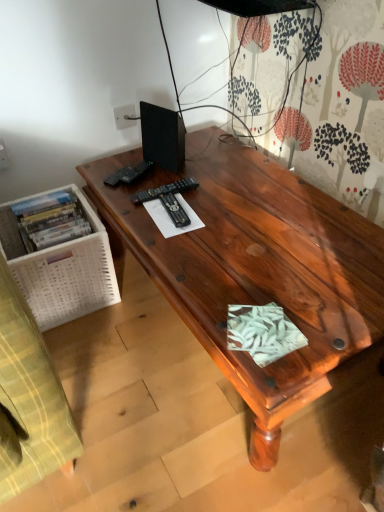
Question: Is black plastic remote control at center, which appears as the 1th remote control when viewed from the front, at the left side of black plastic remote control at center, acting as the second remote control starting from the front?

Choices:
 (A) yes
 (B) no

Answer: (B)

Question: Is black plastic remote control at center, the 3th remote control positioned from the back, aimed at black plastic remote control at center, acting as the second remote control starting from the front?

Choices:
 (A) yes
 (B) no

Answer: (B)

Question: Does black plastic remote control at center, the 3th remote control positioned from the back, have a larger size compared to black plastic remote control at center, acting as the second remote control starting from the front?

Choices:
 (A) no
 (B) yes

Answer: (A)

Question: Considering the relative sizes of black plastic remote control at center, the 3th remote control positioned from the back, and black plastic remote control at center, acting as the second remote control starting from the front, in the image provided, is black plastic remote control at center, the 3th remote control positioned from the back, wider than black plastic remote control at center, acting as the second remote control starting from the front,?

Choices:
 (A) yes
 (B) no

Answer: (B)

Question: Are black plastic remote control at center, the 3th remote control positioned from the back, and black plastic remote control at center, the 2th remote control viewed from the back, located far from each other?

Choices:
 (A) yes
 (B) no

Answer: (B)

Question: From a real-world perspective, is black plastic remote control at center, the 2th remote control viewed from the back, above or below black matte speaker at upper left?

Choices:
 (A) above
 (B) below

Answer: (B)

Question: Visually, is black plastic remote control at center, the 2th remote control viewed from the back, positioned to the left or to the right of black matte speaker at upper left?

Choices:
 (A) left
 (B) right

Answer: (B)

Question: Looking at the image, does black plastic remote control at center, acting as the second remote control starting from the front, seem bigger or smaller compared to black matte speaker at upper left?

Choices:
 (A) small
 (B) big

Answer: (A)

Question: From their relative heights in the image, would you say black plastic remote control at center, acting as the second remote control starting from the front, is taller or shorter than black matte speaker at upper left?

Choices:
 (A) tall
 (B) short

Answer: (B)

Question: Is point (117, 179) positioned closer to the camera than point (134, 195)?

Choices:
 (A) farther
 (B) closer

Answer: (A)

Question: From a real-world perspective, is black plastic remote control at upper left, marked as the third remote control in a front-to-back arrangement, positioned above or below black plastic remote control at center, acting as the second remote control starting from the front?

Choices:
 (A) above
 (B) below

Answer: (A)

Question: Looking at their shapes, would you say black plastic remote control at upper left, marked as the third remote control in a front-to-back arrangement, is wider or thinner than black plastic remote control at center, the 2th remote control viewed from the back?

Choices:
 (A) thin
 (B) wide

Answer: (A)

Question: Looking at the image, does black plastic remote control at upper left, marked as the third remote control in a front-to-back arrangement, seem bigger or smaller compared to black plastic remote control at center, the 2th remote control viewed from the back?

Choices:
 (A) small
 (B) big

Answer: (A)

Question: From the image's perspective, is satin wood desk at center positioned above or below black matte speaker at upper left?

Choices:
 (A) below
 (B) above

Answer: (A)

Question: Is satin wood desk at center spatially inside black matte speaker at upper left, or outside of it?

Choices:
 (A) inside
 (B) outside

Answer: (B)